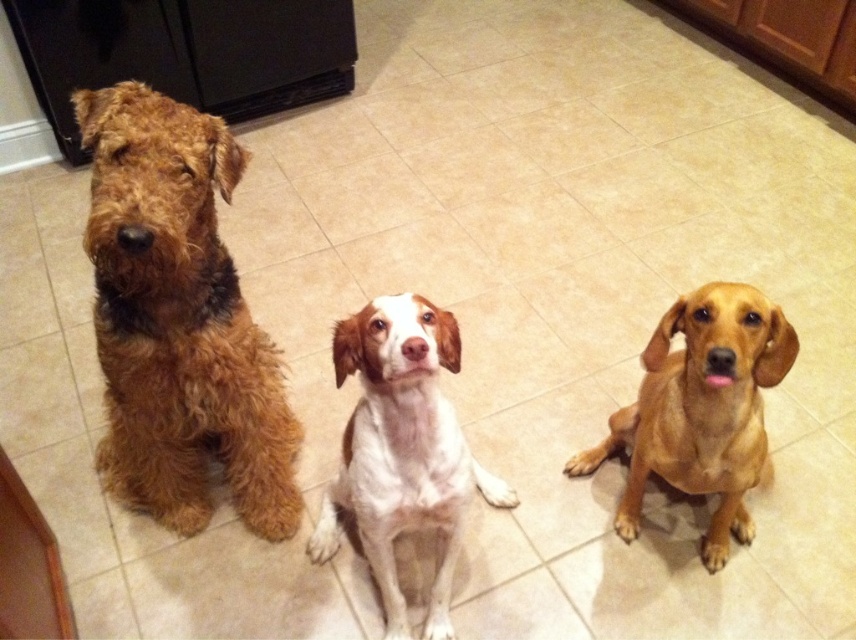
Question: Does fuzzy brown dog at left come in front of white soft fur dog at center?

Choices:
 (A) no
 (B) yes

Answer: (A)

Question: From the image, what is the correct spatial relationship of white soft fur dog at center in relation to golden smooth coat dog at center?

Choices:
 (A) below
 (B) above

Answer: (A)

Question: Which of the following is the closest to the observer?

Choices:
 (A) (354, 477)
 (B) (625, 531)

Answer: (A)

Question: Which point is closer to the camera taking this photo?

Choices:
 (A) [684, 301]
 (B) [144, 230]
 (C) [385, 452]

Answer: (B)

Question: Estimate the real-world distances between objects in this image. Which object is closer to the white soft fur dog at center?

Choices:
 (A) golden smooth coat dog at center
 (B) fuzzy brown dog at left

Answer: (B)

Question: Does fuzzy brown dog at left have a larger size compared to golden smooth coat dog at center?

Choices:
 (A) no
 (B) yes

Answer: (B)